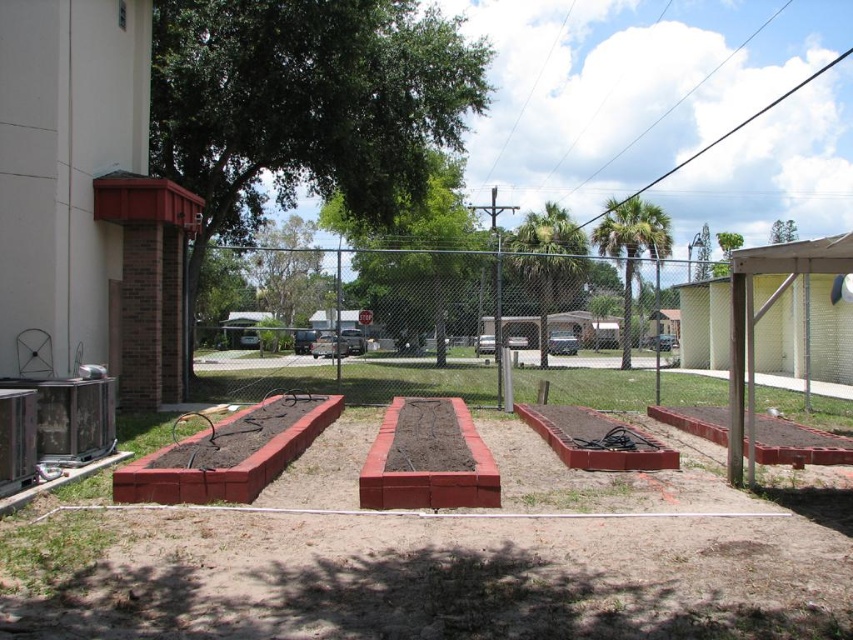
Who is more forward, (276,412) or (404,506)?

Positioned in front is point (404,506).

You are a GUI agent. You are given a task and a screenshot of the screen. Output one action in this format:
    pyautogui.click(x=<x>, y=<y>)
    Task: Click on the red brick flower bed at lower left
    This screenshot has width=853, height=640.
    Given the screenshot: What is the action you would take?
    pyautogui.click(x=228, y=454)

Describe the element at coordinates (228, 454) in the screenshot. I see `red brick flower bed at lower left` at that location.

In order to click on red brick flower bed at lower left in this screenshot , I will do `click(228, 454)`.

This screenshot has width=853, height=640. Describe the element at coordinates (363, 356) in the screenshot. I see `metallic chain-link fence at center` at that location.

Is metallic chain-link fence at center wider than brown brick flower bed at center?

Yes.

The image size is (853, 640). I want to click on metallic chain-link fence at center, so click(x=363, y=356).

Does metallic chain-link fence at center appear on the right side of red brick flower bed at lower left?

Indeed, metallic chain-link fence at center is positioned on the right side of red brick flower bed at lower left.

Which is above, metallic chain-link fence at center or red brick flower bed at lower left?

metallic chain-link fence at center is above.

Does point (486, 320) lie in front of point (244, 497)?

No, (486, 320) is further to viewer.

Locate an element on the screen. metallic chain-link fence at center is located at coordinates (363, 356).